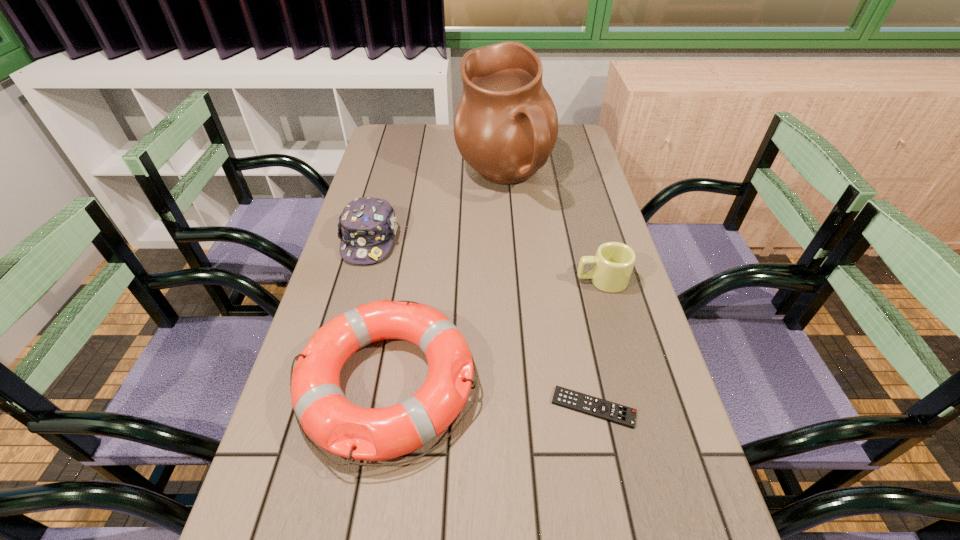
Find the location of a particular element. cream pitcher is located at coordinates 506,125.

Image resolution: width=960 pixels, height=540 pixels. In order to click on headwear in this screenshot , I will do `click(367, 226)`.

Image resolution: width=960 pixels, height=540 pixels. Find the location of `the third nearest object`. the third nearest object is located at coordinates coord(613,263).

This screenshot has width=960, height=540. Identify the location of life buoy. (322, 411).

Identify the location of remote control. (570, 399).

This screenshot has width=960, height=540. Identify the location of free space located at the spout of the cream pitcher. (381, 179).

The image size is (960, 540). I want to click on vacant space located 0.260m at the spout of the cream pitcher, so click(378, 179).

Identify the location of free space located 0.080m at the spout of the cream pitcher. (431, 179).

Identify the location of vacant space located 0.340m on the front-facing side of the headwear. This screenshot has width=960, height=540. (333, 375).

The width and height of the screenshot is (960, 540). I want to click on blank area located with the handle on the side of the mug, so click(x=476, y=280).